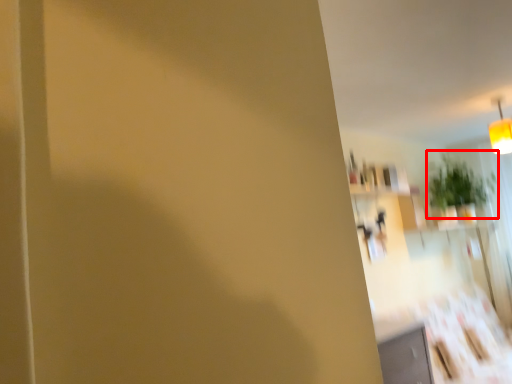
Question: In this image, where is plant (annotated by the red box) located relative to light fixture?

Choices:
 (A) left
 (B) right

Answer: (B)